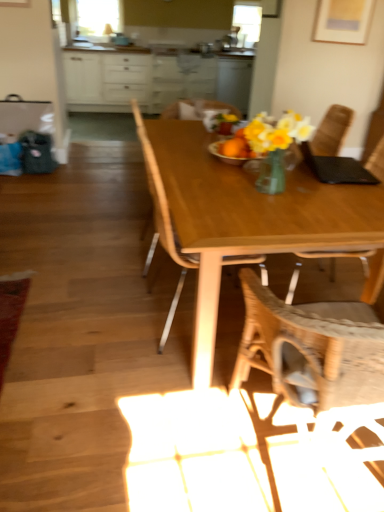
Find the location of a particular element. free space to the left of wooden chair at center, the first chair positioned from the left is located at coordinates (103, 314).